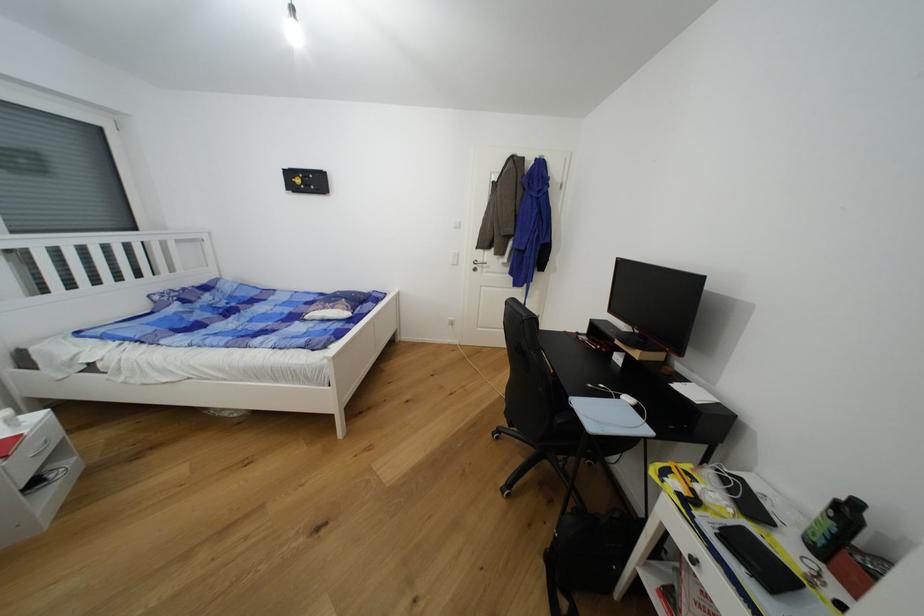
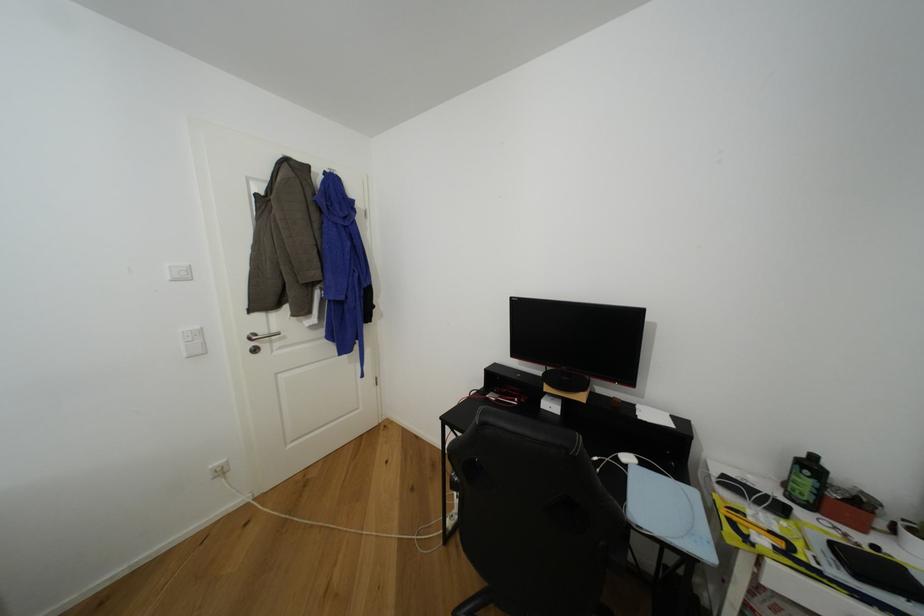
In the second image, find the point that corresponds to pixel 464 228 in the first image.

(190, 278)